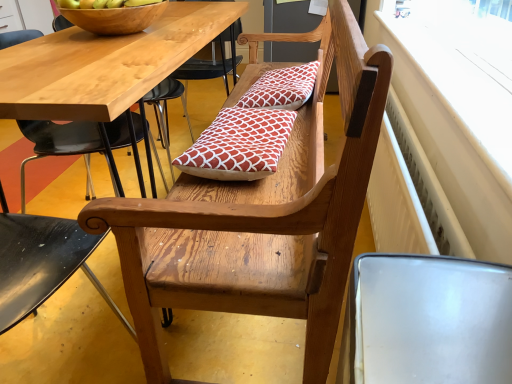
Question: Is wooden bowl at upper left at the left side of red printed cushion at center, which is counted as the 2th pillow, starting from the top?

Choices:
 (A) yes
 (B) no

Answer: (A)

Question: From the image's perspective, is wooden bowl at upper left located beneath red printed cushion at center, which appears as the first pillow when ordered from the bottom?

Choices:
 (A) yes
 (B) no

Answer: (B)

Question: Considering the relative sizes of wooden bowl at upper left and red printed cushion at center, which is counted as the 2th pillow, starting from the top, in the image provided, is wooden bowl at upper left smaller than red printed cushion at center, which is counted as the 2th pillow, starting from the top,?

Choices:
 (A) yes
 (B) no

Answer: (B)

Question: Considering the relative sizes of wooden bowl at upper left and red printed cushion at center, positioned as the 2th pillow in back-to-front order, in the image provided, is wooden bowl at upper left bigger than red printed cushion at center, positioned as the 2th pillow in back-to-front order,?

Choices:
 (A) no
 (B) yes

Answer: (B)

Question: Is wooden bowl at upper left not close to red printed cushion at center, which appears as the first pillow when ordered from the bottom?

Choices:
 (A) yes
 (B) no

Answer: (B)

Question: Based on their positions, is wooden bench at center located to the left or right of white plastic radiator at upper right?

Choices:
 (A) right
 (B) left

Answer: (B)

Question: Is point (228, 276) closer or farther from the camera than point (462, 66)?

Choices:
 (A) closer
 (B) farther

Answer: (A)

Question: Choose the correct answer: Is wooden bench at center inside white plastic radiator at upper right or outside it?

Choices:
 (A) inside
 (B) outside

Answer: (B)

Question: In terms of width, does wooden bench at center look wider or thinner when compared to white plastic radiator at upper right?

Choices:
 (A) wide
 (B) thin

Answer: (A)

Question: Looking at the image, does red printed cushion at center, which appears as the first pillow when viewed from the top, seem bigger or smaller compared to wooden chair at left?

Choices:
 (A) big
 (B) small

Answer: (B)

Question: Considering their positions, is red printed cushion at center, positioned as the 2th pillow in front-to-back order, located in front of or behind wooden chair at left?

Choices:
 (A) behind
 (B) front

Answer: (A)

Question: Would you say red printed cushion at center, positioned as the 2th pillow in front-to-back order, is inside or outside wooden chair at left?

Choices:
 (A) outside
 (B) inside

Answer: (A)

Question: From the image's perspective, is red printed cushion at center, the 1th pillow viewed from the back, above or below wooden chair at left?

Choices:
 (A) below
 (B) above

Answer: (B)

Question: In the image, is wooden chair at left on the left side or the right side of white plastic radiator at upper right?

Choices:
 (A) left
 (B) right

Answer: (A)

Question: Is wooden chair at left in front of or behind white plastic radiator at upper right in the image?

Choices:
 (A) behind
 (B) front

Answer: (B)